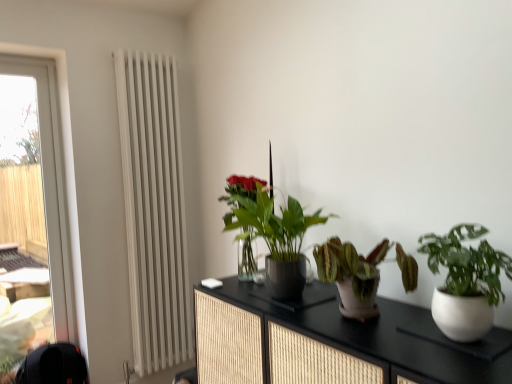
The width and height of the screenshot is (512, 384). What do you see at coordinates (351, 275) in the screenshot? I see `leathery terracotta pot at center, the second houseplant positioned from the front` at bounding box center [351, 275].

Where is `green glossy plant at center, the first houseplant in the back-to-front sequence`? This screenshot has height=384, width=512. green glossy plant at center, the first houseplant in the back-to-front sequence is located at coordinates (239, 193).

This screenshot has width=512, height=384. Identify the location of white matte pot at right, the 1th houseplant from the front. (465, 282).

The image size is (512, 384). Identify the location of leathery terracotta pot at center, placed as the 3th houseplant when sorted from back to front. (351, 275).

Which is farther from the camera, (154, 365) or (282, 299)?

The point (154, 365) is more distant.

Can you confirm if white metallic radiator at left is thinner than green matte plant at center, which appears as the 2th houseplant when viewed from the back?

Yes.

Is white metallic radiator at left taller or shorter than green matte plant at center, the third houseplant viewed from the front?

In the image, white metallic radiator at left appears to be taller than green matte plant at center, the third houseplant viewed from the front.

Considering the positions of objects white metallic radiator at left and green matte plant at center, which appears as the 2th houseplant when viewed from the back, in the image provided, who is in front, white metallic radiator at left or green matte plant at center, which appears as the 2th houseplant when viewed from the back,?

green matte plant at center, which appears as the 2th houseplant when viewed from the back, is closer to the camera.

Can you see transparent glass window at left touching green matte plant at center, which appears as the 2th houseplant when viewed from the back?

No, transparent glass window at left is not next to green matte plant at center, which appears as the 2th houseplant when viewed from the back.

From a real-world perspective, which object rests below the other?

In real-world perspective, green matte plant at center, which appears as the 2th houseplant when viewed from the back, is lower.

Is green matte plant at center, which appears as the 2th houseplant when viewed from the back, at the back of transparent glass window at left?

No, transparent glass window at left is not facing away from green matte plant at center, which appears as the 2th houseplant when viewed from the back.

From the image's perspective, which one is positioned higher, transparent glass window at left or green matte plant at center, the third houseplant viewed from the front?

green matte plant at center, the third houseplant viewed from the front, appears higher in the image.

Is black fabric swivel chair at lower left situated inside white matte pot at right, the 1th houseplant from the front, or outside?

black fabric swivel chair at lower left is located beyond the bounds of white matte pot at right, the 1th houseplant from the front.

Can you confirm if black fabric swivel chair at lower left is smaller than white matte pot at right, the 4th houseplant viewed from the back?

No, black fabric swivel chair at lower left is not smaller than white matte pot at right, the 4th houseplant viewed from the back.

Which is behind, black fabric swivel chair at lower left or white matte pot at right, the 1th houseplant from the front?

Positioned behind is black fabric swivel chair at lower left.

From the black fabric swivel chair at lower left, count 4th houseplants forward and point to it. Please provide its 2D coordinates.

[(465, 282)]

Is point (320, 278) in front of point (383, 356)?

That is False.

Who is taller, leathery terracotta pot at center, placed as the 3th houseplant when sorted from back to front, or black textured cabinet at center?

Standing taller between the two is black textured cabinet at center.

From the image's perspective, which is below, leathery terracotta pot at center, placed as the 3th houseplant when sorted from back to front, or black textured cabinet at center?

From the image's view, black textured cabinet at center is below.

Relative to black textured cabinet at center, is leathery terracotta pot at center, the second houseplant positioned from the front, in front or behind?

Clearly, leathery terracotta pot at center, the second houseplant positioned from the front, is behind black textured cabinet at center.

Can you confirm if black fabric swivel chair at lower left is smaller than white metallic radiator at left?

Yes, black fabric swivel chair at lower left is smaller than white metallic radiator at left.

How many degrees apart are the facing directions of black fabric swivel chair at lower left and white metallic radiator at left?

0.00561 degrees.

I want to click on swivel chair in front of the white metallic radiator at left, so click(53, 365).

Which object is closer to the camera, transparent glass window at left or black fabric swivel chair at lower left?

black fabric swivel chair at lower left is closer to the camera.

Based on the photo, is transparent glass window at left next to black fabric swivel chair at lower left?

They are not placed beside each other.

Between transparent glass window at left and black fabric swivel chair at lower left, which one appears on the left side from the viewer's perspective?

transparent glass window at left.

Can you tell me how much green glossy plant at center, the fourth houseplant positioned from the front, and black fabric swivel chair at lower left differ in facing direction?

The angle between the facing direction of green glossy plant at center, the fourth houseplant positioned from the front, and the facing direction of black fabric swivel chair at lower left is 93.2 degrees.

Is the surface of green glossy plant at center, the first houseplant in the back-to-front sequence, in direct contact with black fabric swivel chair at lower left?

No, green glossy plant at center, the first houseplant in the back-to-front sequence, is not with black fabric swivel chair at lower left.

Consider the image. From a real-world perspective, does green glossy plant at center, the first houseplant in the back-to-front sequence, sit lower than black fabric swivel chair at lower left?

No.

Can you confirm if green glossy plant at center, the fourth houseplant positioned from the front, is thinner than black fabric swivel chair at lower left?

Yes, green glossy plant at center, the fourth houseplant positioned from the front, is thinner than black fabric swivel chair at lower left.

The width and height of the screenshot is (512, 384). Identify the location of radiator that is on the left side of green matte plant at center, the third houseplant viewed from the front. [x=154, y=210].

Starting from the transparent glass window at left, which houseplant is the 2nd one to the right? Please provide its 2D coordinates.

[(272, 231)]

Considering their positions, is black fabric swivel chair at lower left positioned further to white matte pot at right, the 1th houseplant from the front, than white metallic radiator at left?

black fabric swivel chair at lower left lies further to white matte pot at right, the 1th houseplant from the front, than the other object.

Based on their spatial positions, is white metallic radiator at left or transparent glass window at left further from leathery terracotta pot at center, placed as the 3th houseplant when sorted from back to front?

Based on the image, transparent glass window at left appears to be further to leathery terracotta pot at center, placed as the 3th houseplant when sorted from back to front.

Based on their spatial positions, is black textured cabinet at center or white matte pot at right, the 4th houseplant viewed from the back, closer to leathery terracotta pot at center, the second houseplant positioned from the front?

black textured cabinet at center is positioned closer to the anchor leathery terracotta pot at center, the second houseplant positioned from the front.

Based on their spatial positions, is green matte plant at center, which appears as the 2th houseplant when viewed from the back, or white metallic radiator at left closer to green glossy plant at center, the fourth houseplant positioned from the front?

green matte plant at center, which appears as the 2th houseplant when viewed from the back.

Estimate the real-world distances between objects in this image. Which object is further from leathery terracotta pot at center, the second houseplant positioned from the front, green matte plant at center, the third houseplant viewed from the front, or black textured cabinet at center?

green matte plant at center, the third houseplant viewed from the front.

Based on their spatial positions, is green glossy plant at center, the first houseplant in the back-to-front sequence, or black textured cabinet at center closer to transparent glass window at left?

Based on the image, green glossy plant at center, the first houseplant in the back-to-front sequence, appears to be nearer to transparent glass window at left.

Based on their spatial positions, is white matte pot at right, the 4th houseplant viewed from the back, or transparent glass window at left closer to green glossy plant at center, the first houseplant in the back-to-front sequence?

The object closer to green glossy plant at center, the first houseplant in the back-to-front sequence, is white matte pot at right, the 4th houseplant viewed from the back.

Based on their spatial positions, is black textured cabinet at center or green matte plant at center, which appears as the 2th houseplant when viewed from the back, closer to transparent glass window at left?

Based on the image, green matte plant at center, which appears as the 2th houseplant when viewed from the back, appears to be nearer to transparent glass window at left.

I want to click on houseplant situated between black fabric swivel chair at lower left and green matte plant at center, which appears as the 2th houseplant when viewed from the back, from left to right, so click(239, 193).

I want to click on swivel chair positioned between black textured cabinet at center and white metallic radiator at left from near to far, so click(53, 365).

The width and height of the screenshot is (512, 384). I want to click on houseplant between white matte pot at right, the 4th houseplant viewed from the back, and black textured cabinet at center from top to bottom, so click(x=351, y=275).

You are a GUI agent. You are given a task and a screenshot of the screen. Output one action in this format:
    pyautogui.click(x=<x>, y=<y>)
    Task: Click on the radiator between black fabric swivel chair at lower left and leathery terracotta pot at center, the second houseplant positioned from the front, in the horizontal direction
    The height and width of the screenshot is (384, 512).
    Given the screenshot: What is the action you would take?
    pyautogui.click(x=154, y=210)